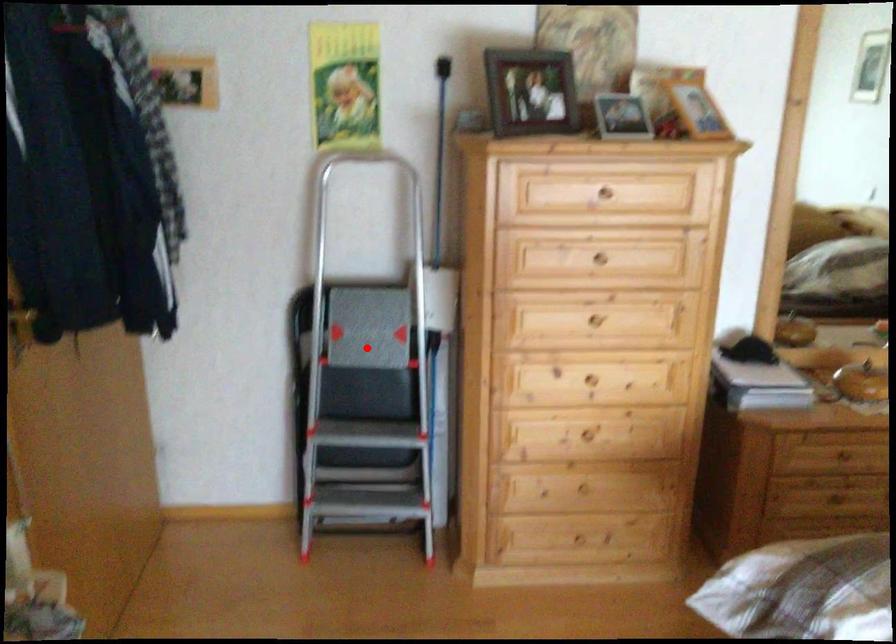
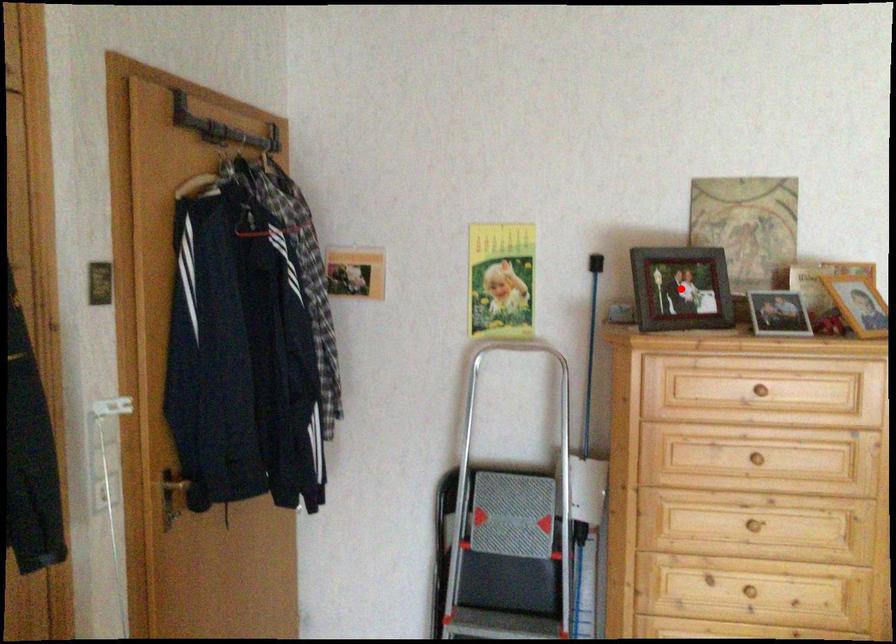
I am providing you with two images of the same scene from different viewpoints. A red point is marked on the first image and another point is marked on the second image. Is the marked point in image1 the same physical position as the marked point in image2?

No